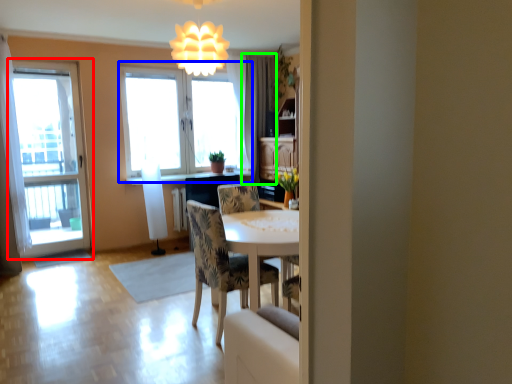
Question: Considering the real-world distances, which object is closest to window (highlighted by a red box)? window (highlighted by a blue box) or curtain (highlighted by a green box).

Choices:
 (A) window
 (B) curtain

Answer: (A)